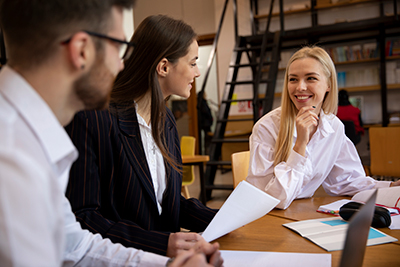
At what (x,y) coordinates should I click in order to perform the action: click on black metallic railing. Please return your answer as a coordinate pair (x, y). The image size is (400, 267). Looking at the image, I should click on (215, 47), (262, 55).